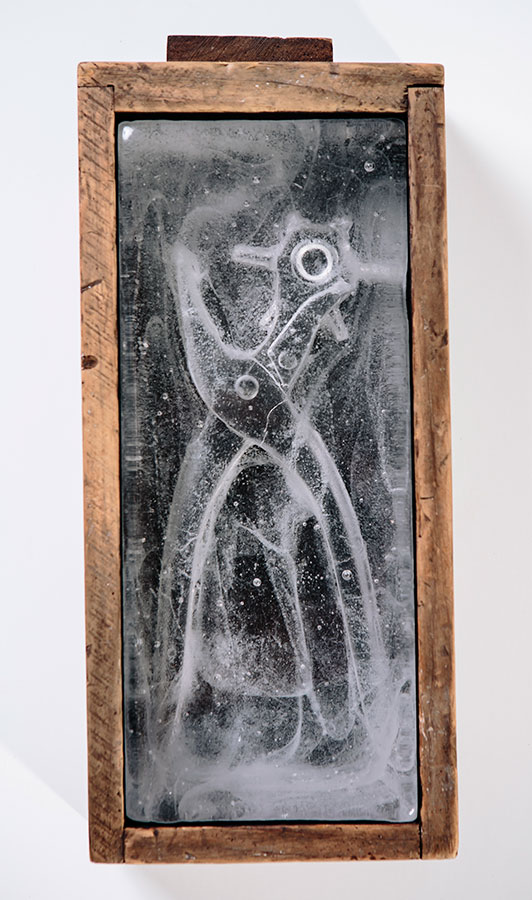
The width and height of the screenshot is (532, 900). I want to click on chalk board looking piece, so click(x=252, y=499).